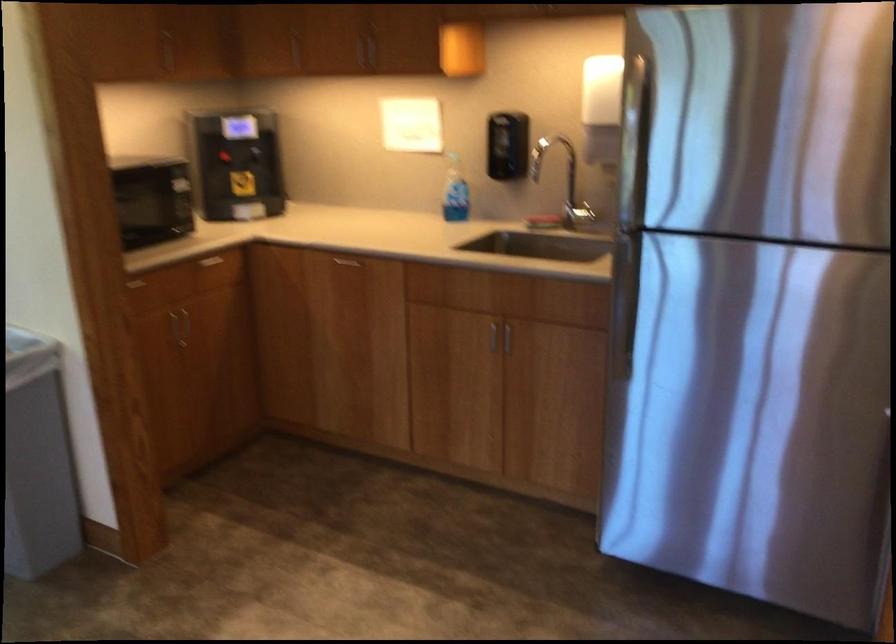
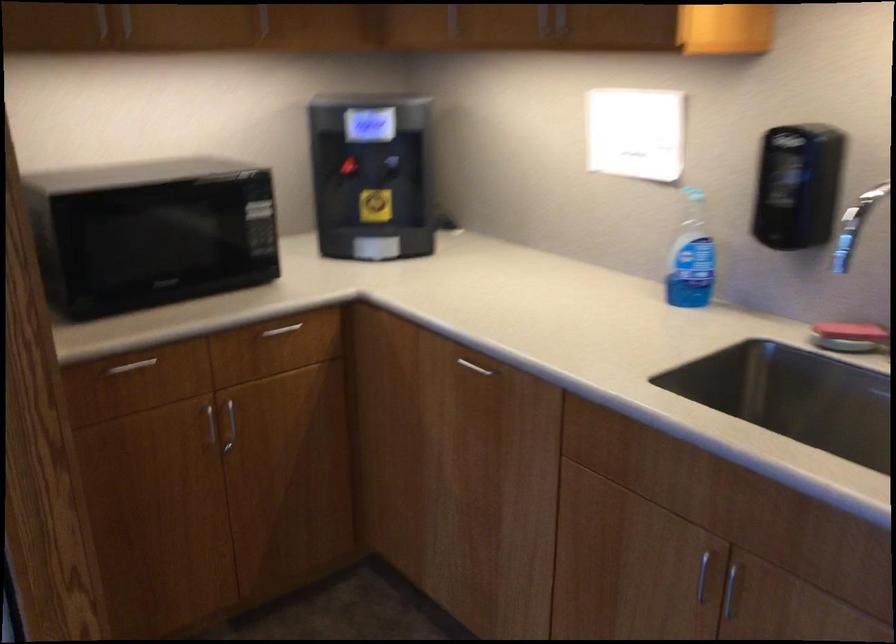
Where in the second image is the point corresponding to [220,156] from the first image?

(345, 167)